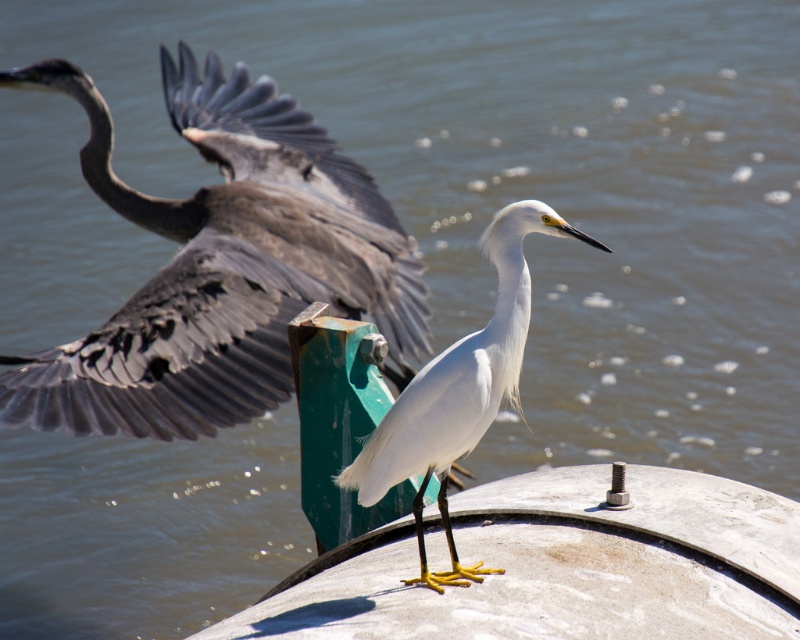
Question: Is gray matte heron at left in front of white matte bird at center?

Choices:
 (A) yes
 (B) no

Answer: (B)

Question: Among these points, which one is nearest to the camera?

Choices:
 (A) (34, 403)
 (B) (413, 429)

Answer: (B)

Question: Which object appears closest to the camera in this image?

Choices:
 (A) white matte bird at center
 (B) gray matte heron at left

Answer: (A)

Question: Does gray matte heron at left have a lesser width compared to white matte bird at center?

Choices:
 (A) yes
 (B) no

Answer: (B)

Question: Does gray matte heron at left lie behind white matte bird at center?

Choices:
 (A) no
 (B) yes

Answer: (B)